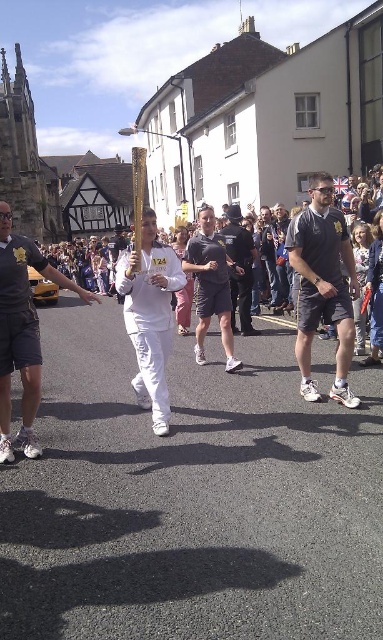
A person is holding a golden torch and standing at point (315, 298). There is a historical building on the left and a Tudor building on the right. If the person wants to run towards the Tudor building, will they have enough space to sprint without obstacles?

The person and the Tudor building are 139.28 feet apart, so there is sufficient space for them to sprint towards the Tudor building without obstacles.

You are a photographer positioned at the back of the street scene. You want to capture both the white matte running suit at center and the dark gray shorts at center in a single shot. What is the minimum distance you need to be from the subjects to ensure both are fully visible in your frame?

The white matte running suit at center and dark gray shorts at center are 6.78 meters apart from each other. To capture both in a single shot, you need to position yourself at least 6.78 meters away from the closer subject to ensure the entire distance between them fits within the frame.